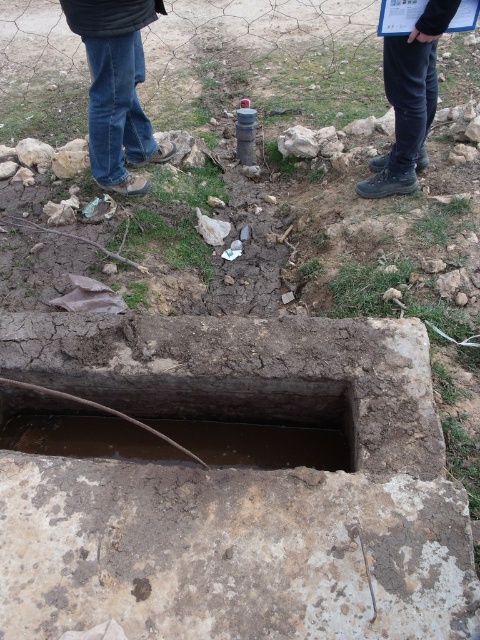
Question: Is the position of brown concrete hole at center less distant than that of jeans at center?

Choices:
 (A) no
 (B) yes

Answer: (B)

Question: Which of the following is the farthest from the observer?

Choices:
 (A) black leather pants at upper right
 (B) jeans at center
 (C) brown concrete hole at center

Answer: (B)

Question: Which point is farther from the camera taking this photo?

Choices:
 (A) (396, 54)
 (B) (12, 449)

Answer: (A)

Question: Does brown concrete hole at center have a lesser width compared to jeans at center?

Choices:
 (A) yes
 (B) no

Answer: (B)

Question: Can you confirm if brown concrete hole at center is thinner than jeans at center?

Choices:
 (A) yes
 (B) no

Answer: (B)

Question: Among these objects, which one is nearest to the camera?

Choices:
 (A) jeans at center
 (B) brown concrete hole at center
 (C) black leather pants at upper right

Answer: (B)